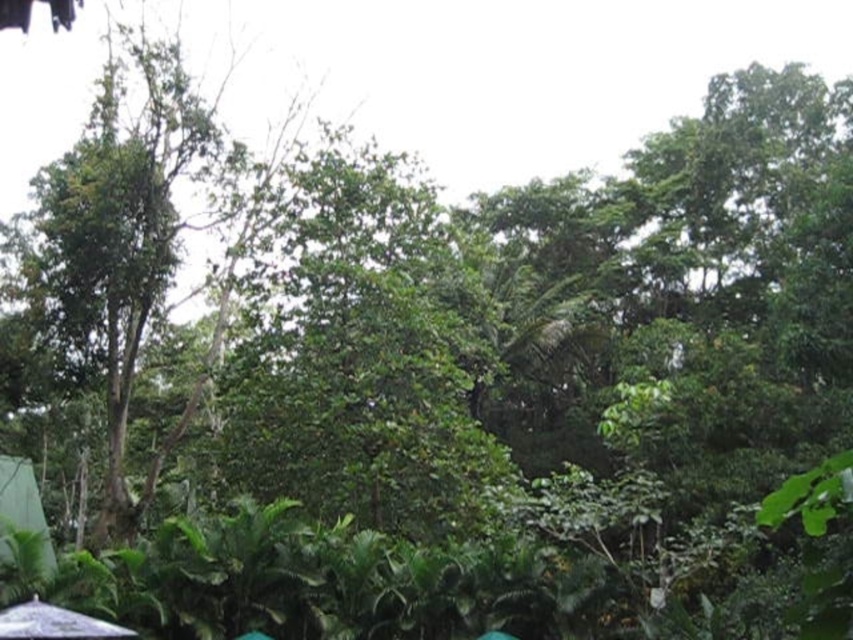
Who is taller, green leafy canopy at lower left or white matte umbrella at lower left?

Standing taller between the two is white matte umbrella at lower left.

Does point (50, 564) come closer to viewer compared to point (50, 620)?

That is False.

Who is more distant from viewer, (10, 506) or (90, 628)?

The point (10, 506) is more distant.

Identify the location of green leafy canopy at lower left. (22, 513).